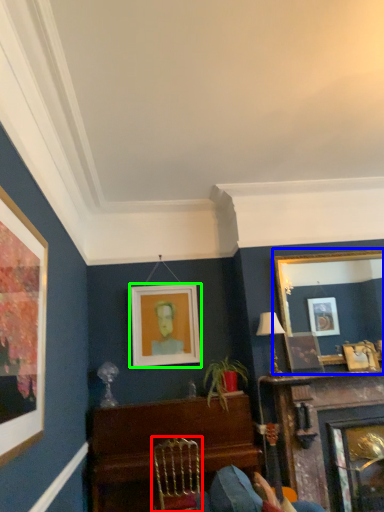
Question: Which object is positioned farthest from chair (highlighted by a red box)? Select from picture frame (highlighted by a blue box) and picture frame (highlighted by a green box).

Choices:
 (A) picture frame
 (B) picture frame

Answer: (A)